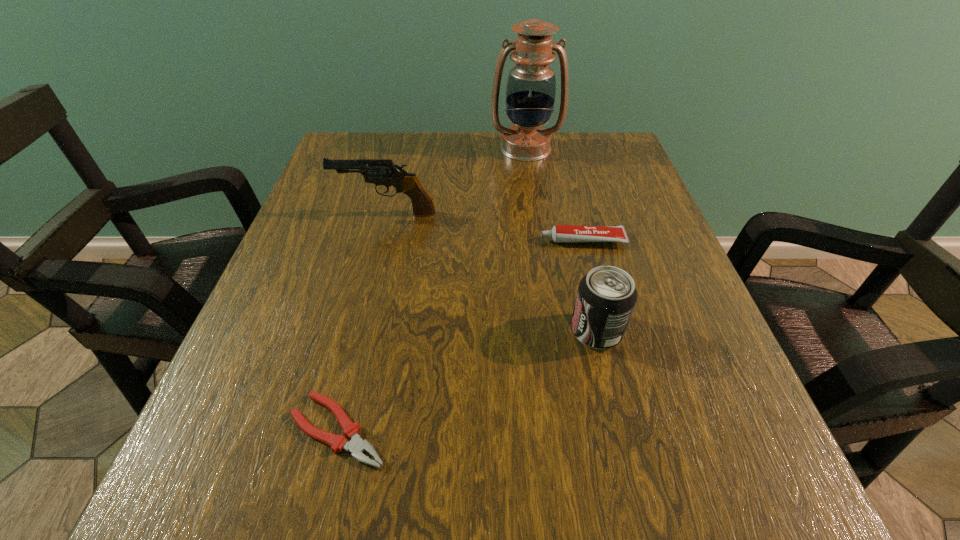
In the image, there is a desktop. Find the location of `blank space at the near right corner`. blank space at the near right corner is located at coordinates (791, 502).

Identify the location of free area in between the nearest object and the tallest object. (432, 289).

You are a GUI agent. You are given a task and a screenshot of the screen. Output one action in this format:
    pyautogui.click(x=<x>, y=<y>)
    Task: Click on the free area in between the shortest object and the soda can
    The height and width of the screenshot is (540, 960).
    Given the screenshot: What is the action you would take?
    pyautogui.click(x=468, y=380)

The width and height of the screenshot is (960, 540). Find the location of `free point between the second farthest object and the shortest object`. free point between the second farthest object and the shortest object is located at coordinates (362, 322).

Find the location of a particular element. free space between the soda can and the shortest object is located at coordinates (468, 380).

The height and width of the screenshot is (540, 960). I want to click on free spot between the third nearest object and the nearest object, so click(461, 335).

The width and height of the screenshot is (960, 540). I want to click on vacant space in between the fourth nearest object and the third shortest object, so tap(492, 272).

Locate an element on the screen. Image resolution: width=960 pixels, height=540 pixels. empty space that is in between the farthest object and the nearest object is located at coordinates tap(432, 289).

Choose which object is the third nearest neighbor to the second shortest object. Please provide its 2D coordinates. Your answer should be formatted as a tuple, i.e. [(x, y)], where the tuple contains the x and y coordinates of a point satisfying the conditions above.

[(531, 85)]

Choose which object is the fourth nearest neighbor to the fourth nearest object. Please provide its 2D coordinates. Your answer should be formatted as a tuple, i.e. [(x, y)], where the tuple contains the x and y coordinates of a point satisfying the conditions above.

[(356, 446)]